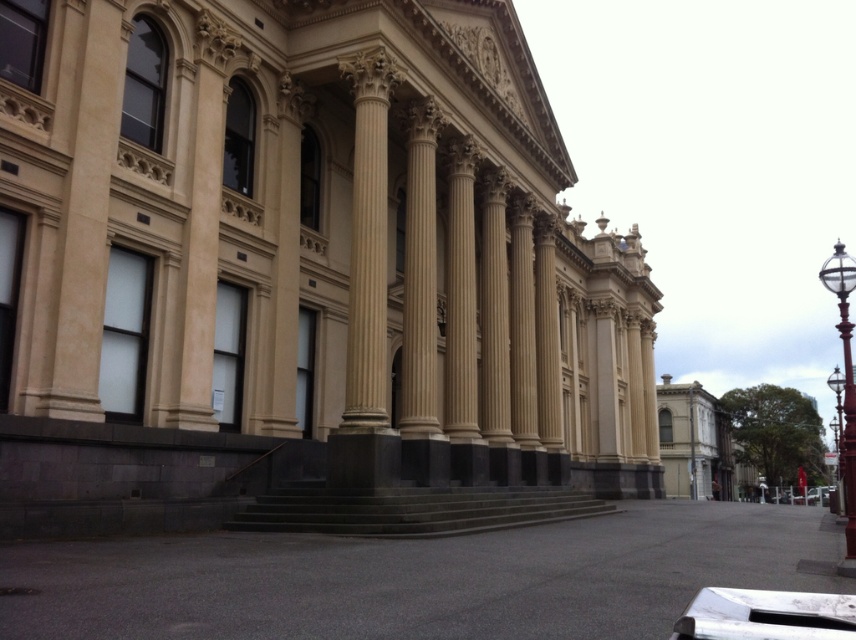
Question: Does polished brass streetlamp at right appear on the right side of polished brass lamp post at right?

Choices:
 (A) yes
 (B) no

Answer: (B)

Question: Is polished brass streetlamp at right to the left of polished brass lamp post at right from the viewer's perspective?

Choices:
 (A) no
 (B) yes

Answer: (B)

Question: Can you confirm if polished brass streetlamp at right is positioned above polished brass lamp post at right?

Choices:
 (A) yes
 (B) no

Answer: (A)